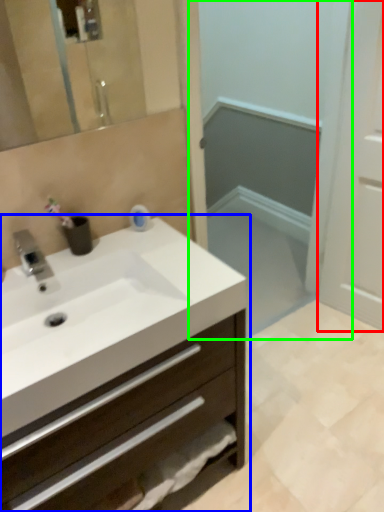
Question: Which object is positioned farthest from screen door (highlighted by a red box)? Select from bathroom cabinet (highlighted by a blue box) and screen door (highlighted by a green box).

Choices:
 (A) bathroom cabinet
 (B) screen door

Answer: (A)